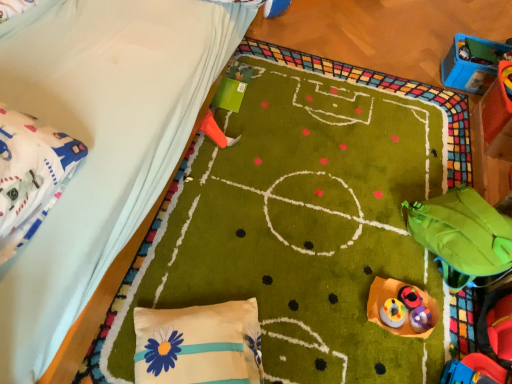
Identify the location of free spot behind rubberized yellow toy at center, which appears as the fifth toy when viewed from the right. The width and height of the screenshot is (512, 384). (387, 291).